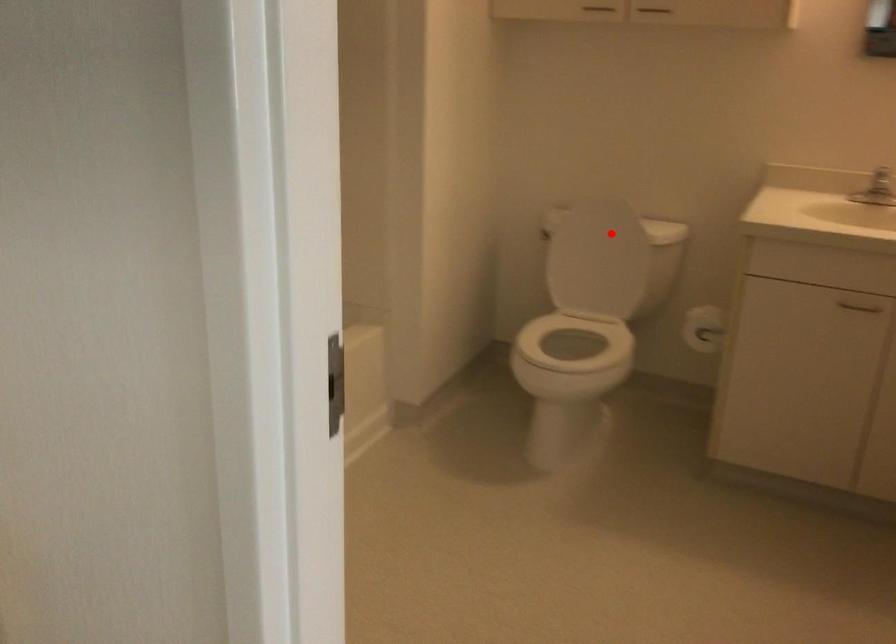
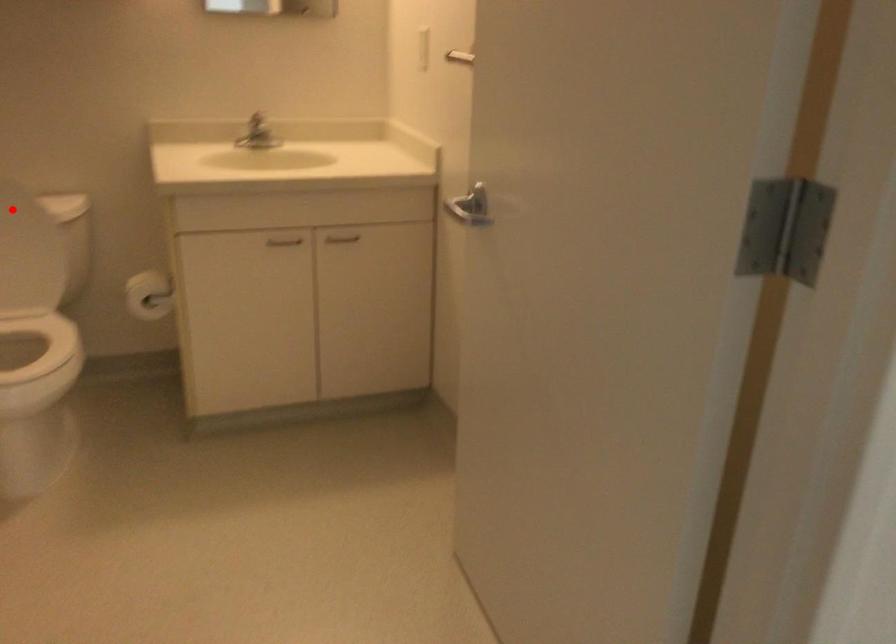
I am providing you with two images of the same scene from different viewpoints. A red point is marked on the first image and another point is marked on the second image. Are the points marked in image1 and image2 representing the same 3D position?

Yes